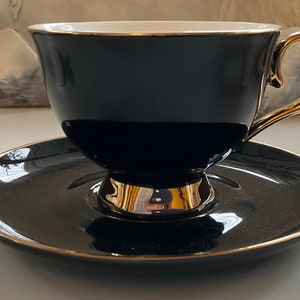
The width and height of the screenshot is (300, 300). In order to click on table in this screenshot , I will do `click(32, 121)`.